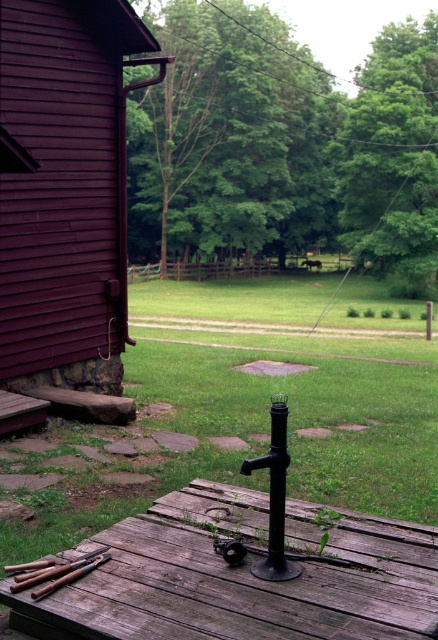
You are a maintenance worker needing to reach the wooden handles at lower left from the matte purple siding at left. Can you walk directly between them without stepping off the deck?

The distance between the matte purple siding at left and the wooden handles at lower left is 6.61 meters. Since the deck is in the foreground and the ground around has grass and dirt, you can walk directly between them on the deck as long as the deck spans that distance. However, the description does not specify the deck size, so assume the deck allows it unless stated otherwise.

You are standing on the ground near the rustic wood deck at center and want to pick up the wooden handles at lower left. Which object is higher in elevation?

The rustic wood deck at center is higher than the wooden handles at lower left, so you would need to step down from the deck to reach the handles.

You are standing at the edge of the rustic wood deck at center. If you walk straight ahead, which direction would you be facing relative to the wooden structure with dark purple siding on the left side?

Since the rustic wood deck at center is located at point (243, 576), walking straight ahead from its edge would face you away from the wooden structure with dark purple siding on the left side, towards the open area in front of the deck.